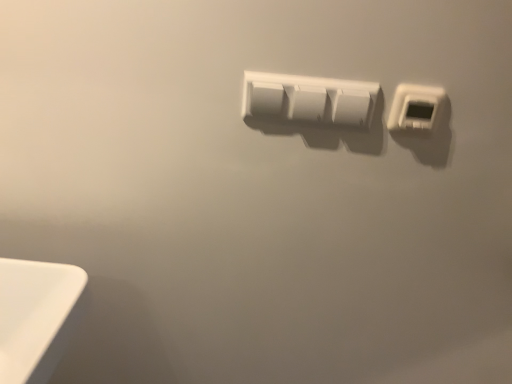
Where is `white plastic power plugs and sockets at center, which appears as the second power plugs and sockets when viewed from the right`? white plastic power plugs and sockets at center, which appears as the second power plugs and sockets when viewed from the right is located at coordinates (309, 99).

This screenshot has width=512, height=384. What do you see at coordinates (309, 99) in the screenshot?
I see `white plastic power plugs and sockets at center, which ranks as the first power plugs and sockets in left-to-right order` at bounding box center [309, 99].

This screenshot has width=512, height=384. Describe the element at coordinates (415, 107) in the screenshot. I see `white plastic thermostat at upper right, which ranks as the 1th power plugs and sockets in right-to-left order` at that location.

In order to click on white plastic thermostat at upper right, which appears as the second power plugs and sockets when viewed from the left in this screenshot , I will do `click(415, 107)`.

Identify the location of white plastic power plugs and sockets at center, which ranks as the first power plugs and sockets in left-to-right order. (309, 99).

Which is more to the right, white plastic thermostat at upper right, which appears as the second power plugs and sockets when viewed from the left, or white plastic power plugs and sockets at center, which appears as the second power plugs and sockets when viewed from the right?

white plastic thermostat at upper right, which appears as the second power plugs and sockets when viewed from the left.

Does white plastic thermostat at upper right, which appears as the second power plugs and sockets when viewed from the left, lie behind white plastic power plugs and sockets at center, which ranks as the first power plugs and sockets in left-to-right order?

No, white plastic thermostat at upper right, which appears as the second power plugs and sockets when viewed from the left, is closer to the viewer.

Which is closer to the camera, (436, 98) or (250, 109)?

Clearly, point (436, 98) is closer to the camera than point (250, 109).

From the image's perspective, is white plastic thermostat at upper right, which ranks as the 1th power plugs and sockets in right-to-left order, located beneath white plastic power plugs and sockets at center, which ranks as the first power plugs and sockets in left-to-right order?

Indeed, from the image's perspective, white plastic thermostat at upper right, which ranks as the 1th power plugs and sockets in right-to-left order, is shown beneath white plastic power plugs and sockets at center, which ranks as the first power plugs and sockets in left-to-right order.

From a real-world perspective, is white plastic thermostat at upper right, which appears as the second power plugs and sockets when viewed from the left, above or below white plastic power plugs and sockets at center, which ranks as the first power plugs and sockets in left-to-right order?

Clearly, from a real-world perspective, white plastic thermostat at upper right, which appears as the second power plugs and sockets when viewed from the left, is above white plastic power plugs and sockets at center, which ranks as the first power plugs and sockets in left-to-right order.

Which object is thinner, white plastic thermostat at upper right, which ranks as the 1th power plugs and sockets in right-to-left order, or white plastic power plugs and sockets at center, which appears as the second power plugs and sockets when viewed from the right?

white plastic power plugs and sockets at center, which appears as the second power plugs and sockets when viewed from the right.

Is white plastic thermostat at upper right, which appears as the second power plugs and sockets when viewed from the left, shorter than white plastic power plugs and sockets at center, which ranks as the first power plugs and sockets in left-to-right order?

Yes.

Considering the sizes of objects white plastic thermostat at upper right, which ranks as the 1th power plugs and sockets in right-to-left order, and white plastic power plugs and sockets at center, which ranks as the first power plugs and sockets in left-to-right order, in the image provided, who is bigger, white plastic thermostat at upper right, which ranks as the 1th power plugs and sockets in right-to-left order, or white plastic power plugs and sockets at center, which ranks as the first power plugs and sockets in left-to-right order,?

white plastic power plugs and sockets at center, which ranks as the first power plugs and sockets in left-to-right order, is bigger.

Is white plastic thermostat at upper right, which appears as the second power plugs and sockets when viewed from the left, not inside white plastic power plugs and sockets at center, which ranks as the first power plugs and sockets in left-to-right order?

Yes, white plastic thermostat at upper right, which appears as the second power plugs and sockets when viewed from the left, is located beyond the bounds of white plastic power plugs and sockets at center, which ranks as the first power plugs and sockets in left-to-right order.

Is white plastic thermostat at upper right, which appears as the second power plugs and sockets when viewed from the left, far from white plastic power plugs and sockets at center, which appears as the second power plugs and sockets when viewed from the right?

No, white plastic thermostat at upper right, which appears as the second power plugs and sockets when viewed from the left, is not far away from white plastic power plugs and sockets at center, which appears as the second power plugs and sockets when viewed from the right.

Is white plastic thermostat at upper right, which appears as the second power plugs and sockets when viewed from the left, looking in the opposite direction of white plastic power plugs and sockets at center, which appears as the second power plugs and sockets when viewed from the right?

white plastic thermostat at upper right, which appears as the second power plugs and sockets when viewed from the left, does not have its back to white plastic power plugs and sockets at center, which appears as the second power plugs and sockets when viewed from the right.

How many degrees apart are the facing directions of white plastic thermostat at upper right, which ranks as the 1th power plugs and sockets in right-to-left order, and white plastic power plugs and sockets at center, which appears as the second power plugs and sockets when viewed from the right?

The angle between the facing direction of white plastic thermostat at upper right, which ranks as the 1th power plugs and sockets in right-to-left order, and the facing direction of white plastic power plugs and sockets at center, which appears as the second power plugs and sockets when viewed from the right, is 0.00255 degrees.

How distant is white plastic thermostat at upper right, which ranks as the 1th power plugs and sockets in right-to-left order, from white plastic power plugs and sockets at center, which appears as the second power plugs and sockets when viewed from the right?

5.01 inches.

Locate an element on the screen. The image size is (512, 384). power plugs and sockets above the white plastic thermostat at upper right, which ranks as the 1th power plugs and sockets in right-to-left order (from the image's perspective) is located at coordinates [309, 99].

Can you confirm if white plastic power plugs and sockets at center, which ranks as the first power plugs and sockets in left-to-right order, is positioned to the left of white plastic thermostat at upper right, which appears as the second power plugs and sockets when viewed from the left?

Correct, you'll find white plastic power plugs and sockets at center, which ranks as the first power plugs and sockets in left-to-right order, to the left of white plastic thermostat at upper right, which appears as the second power plugs and sockets when viewed from the left.

Does white plastic power plugs and sockets at center, which appears as the second power plugs and sockets when viewed from the right, come in front of white plastic thermostat at upper right, which appears as the second power plugs and sockets when viewed from the left?

No, the depth of white plastic power plugs and sockets at center, which appears as the second power plugs and sockets when viewed from the right, is greater than that of white plastic thermostat at upper right, which appears as the second power plugs and sockets when viewed from the left.

Is point (313, 110) positioned behind point (388, 129)?

No.

From the image's perspective, is white plastic power plugs and sockets at center, which ranks as the first power plugs and sockets in left-to-right order, on top of white plastic thermostat at upper right, which appears as the second power plugs and sockets when viewed from the left?

Indeed, from the image's perspective, white plastic power plugs and sockets at center, which ranks as the first power plugs and sockets in left-to-right order, is shown above white plastic thermostat at upper right, which appears as the second power plugs and sockets when viewed from the left.

From a real-world perspective, is white plastic power plugs and sockets at center, which appears as the second power plugs and sockets when viewed from the right, over white plastic thermostat at upper right, which ranks as the 1th power plugs and sockets in right-to-left order?

Incorrect, from a real-world perspective, white plastic power plugs and sockets at center, which appears as the second power plugs and sockets when viewed from the right, is lower than white plastic thermostat at upper right, which ranks as the 1th power plugs and sockets in right-to-left order.

Which of these two, white plastic power plugs and sockets at center, which ranks as the first power plugs and sockets in left-to-right order, or white plastic thermostat at upper right, which ranks as the 1th power plugs and sockets in right-to-left order, is thinner?

white plastic power plugs and sockets at center, which ranks as the first power plugs and sockets in left-to-right order.

Considering the relative sizes of white plastic power plugs and sockets at center, which ranks as the first power plugs and sockets in left-to-right order, and white plastic thermostat at upper right, which appears as the second power plugs and sockets when viewed from the left, in the image provided, is white plastic power plugs and sockets at center, which ranks as the first power plugs and sockets in left-to-right order, shorter than white plastic thermostat at upper right, which appears as the second power plugs and sockets when viewed from the left,?

No.

Based on their sizes in the image, would you say white plastic power plugs and sockets at center, which appears as the second power plugs and sockets when viewed from the right, is bigger or smaller than white plastic thermostat at upper right, which ranks as the 1th power plugs and sockets in right-to-left order?

white plastic power plugs and sockets at center, which appears as the second power plugs and sockets when viewed from the right, is bigger than white plastic thermostat at upper right, which ranks as the 1th power plugs and sockets in right-to-left order.

Is white plastic power plugs and sockets at center, which appears as the second power plugs and sockets when viewed from the right, surrounding white plastic thermostat at upper right, which ranks as the 1th power plugs and sockets in right-to-left order?

No, white plastic thermostat at upper right, which ranks as the 1th power plugs and sockets in right-to-left order, is located outside of white plastic power plugs and sockets at center, which appears as the second power plugs and sockets when viewed from the right.

Would you say white plastic power plugs and sockets at center, which ranks as the first power plugs and sockets in left-to-right order, is a long distance from white plastic thermostat at upper right, which appears as the second power plugs and sockets when viewed from the left?

Actually, white plastic power plugs and sockets at center, which ranks as the first power plugs and sockets in left-to-right order, and white plastic thermostat at upper right, which appears as the second power plugs and sockets when viewed from the left, are a little close together.

In the scene shown: Is white plastic power plugs and sockets at center, which appears as the second power plugs and sockets when viewed from the right, looking in the opposite direction of white plastic thermostat at upper right, which ranks as the 1th power plugs and sockets in right-to-left order?

No, white plastic power plugs and sockets at center, which appears as the second power plugs and sockets when viewed from the right, is not facing the opposite direction of white plastic thermostat at upper right, which ranks as the 1th power plugs and sockets in right-to-left order.

How different are the orientations of white plastic power plugs and sockets at center, which appears as the second power plugs and sockets when viewed from the right, and white plastic thermostat at upper right, which ranks as the 1th power plugs and sockets in right-to-left order, in degrees?

The facing directions of white plastic power plugs and sockets at center, which appears as the second power plugs and sockets when viewed from the right, and white plastic thermostat at upper right, which ranks as the 1th power plugs and sockets in right-to-left order, are 0.00255 degrees apart.

How far apart are white plastic power plugs and sockets at center, which ranks as the first power plugs and sockets in left-to-right order, and white plastic thermostat at upper right, which ranks as the 1th power plugs and sockets in right-to-left order?

A distance of 5.01 inches exists between white plastic power plugs and sockets at center, which ranks as the first power plugs and sockets in left-to-right order, and white plastic thermostat at upper right, which ranks as the 1th power plugs and sockets in right-to-left order.

Identify the location of power plugs and sockets to the right of white plastic power plugs and sockets at center, which appears as the second power plugs and sockets when viewed from the right. Image resolution: width=512 pixels, height=384 pixels. (415, 107).

The height and width of the screenshot is (384, 512). Find the location of `power plugs and sockets behind the white plastic thermostat at upper right, which ranks as the 1th power plugs and sockets in right-to-left order`. power plugs and sockets behind the white plastic thermostat at upper right, which ranks as the 1th power plugs and sockets in right-to-left order is located at coordinates (309, 99).

Locate an element on the screen. power plugs and sockets above the white plastic power plugs and sockets at center, which ranks as the first power plugs and sockets in left-to-right order (from a real-world perspective) is located at coordinates (415, 107).